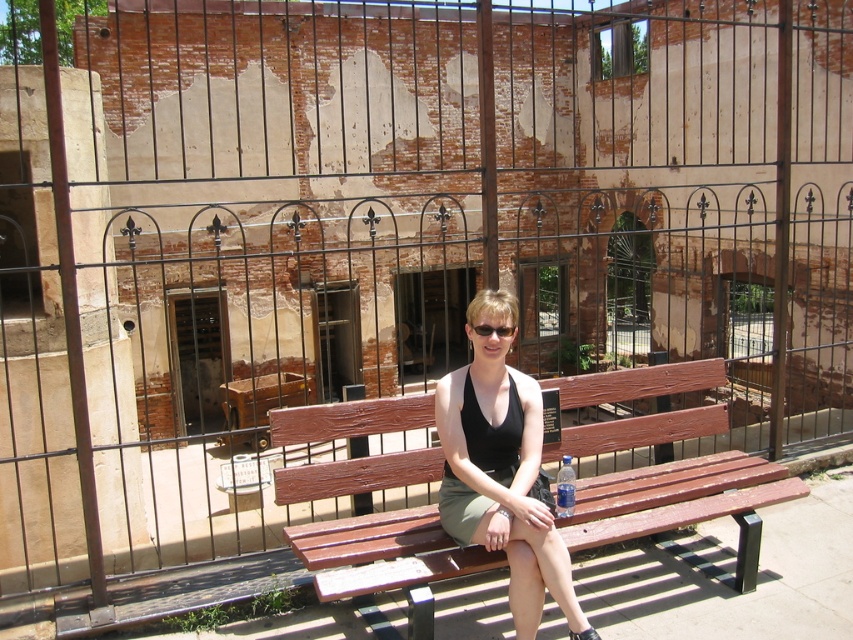
Which is more to the right, wooden bench at center or black plastic goggles at center?

Positioned to the right is wooden bench at center.

Identify the location of wooden bench at center. (679, 500).

Is black fabric tank top at center positioned at the back of black plastic goggles at center?

No.

Which is more to the right, black fabric tank top at center or black plastic goggles at center?

black fabric tank top at center

Is point (494, 356) positioned behind point (514, 326)?

No, (494, 356) is in front of (514, 326).

Find the location of a particular element. black fabric tank top at center is located at coordinates (502, 470).

Does wooden bench at center appear under black fabric tank top at center?

Yes.

Is point (426, 621) in front of point (532, 625)?

Yes, it is.

Identify the location of wooden bench at center. This screenshot has height=640, width=853. (679, 500).